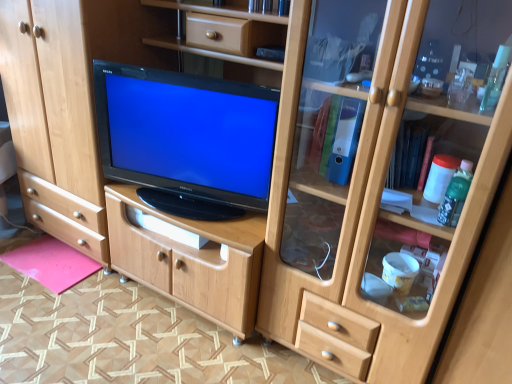
Question: Considering their positions, is pink matte mat at lower left located in front of or behind black glossy television at center?

Choices:
 (A) behind
 (B) front

Answer: (A)

Question: From the image's perspective, relative to black glossy television at center, is pink matte mat at lower left above or below?

Choices:
 (A) above
 (B) below

Answer: (B)

Question: Is pink matte mat at lower left wider or thinner than black glossy television at center?

Choices:
 (A) wide
 (B) thin

Answer: (A)

Question: Considering the relative positions of black glossy television at center and pink matte mat at lower left in the image provided, is black glossy television at center to the left or to the right of pink matte mat at lower left?

Choices:
 (A) right
 (B) left

Answer: (A)

Question: Considering the positions of black glossy television at center and pink matte mat at lower left in the image, is black glossy television at center wider or thinner than pink matte mat at lower left?

Choices:
 (A) wide
 (B) thin

Answer: (B)

Question: Choose the correct answer: Is black glossy television at center inside pink matte mat at lower left or outside it?

Choices:
 (A) outside
 (B) inside

Answer: (A)

Question: From a real-world perspective, is black glossy television at center positioned above or below pink matte mat at lower left?

Choices:
 (A) below
 (B) above

Answer: (B)